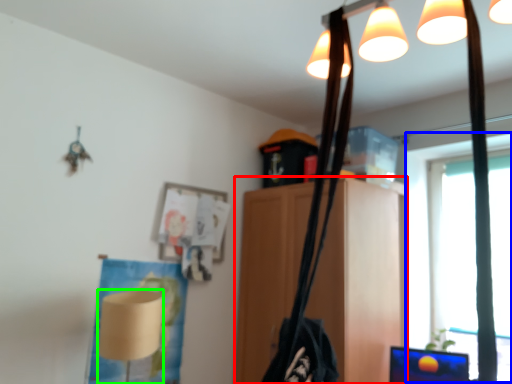
Question: Which object is the closest to the furniture (highlighted by a red box)? Choose among these: window screen (highlighted by a blue box) or lamp (highlighted by a green box).

Choices:
 (A) window screen
 (B) lamp

Answer: (A)